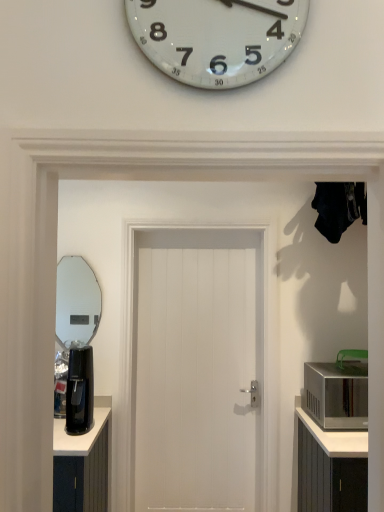
Question: Considering the relative positions of black plastic coffee machine at left and silver metallic microwave at right in the image provided, is black plastic coffee machine at left behind silver metallic microwave at right?

Choices:
 (A) yes
 (B) no

Answer: (B)

Question: Considering the relative sizes of black plastic coffee machine at left and silver metallic microwave at right in the image provided, is black plastic coffee machine at left smaller than silver metallic microwave at right?

Choices:
 (A) yes
 (B) no

Answer: (A)

Question: Is silver metallic microwave at right at the back of black plastic coffee machine at left?

Choices:
 (A) no
 (B) yes

Answer: (A)

Question: Is black plastic coffee machine at left bigger than silver metallic microwave at right?

Choices:
 (A) no
 (B) yes

Answer: (A)

Question: From a real-world perspective, is black plastic coffee machine at left over silver metallic microwave at right?

Choices:
 (A) no
 (B) yes

Answer: (B)

Question: Is point (81, 301) closer or farther from the camera than point (173, 371)?

Choices:
 (A) closer
 (B) farther

Answer: (B)

Question: From the image's perspective, is clear glass mirror at left located above or below white wooden door at center?

Choices:
 (A) above
 (B) below

Answer: (A)

Question: Considering their positions, is clear glass mirror at left located in front of or behind white wooden door at center?

Choices:
 (A) front
 (B) behind

Answer: (B)

Question: Visually, is clear glass mirror at left positioned to the left or to the right of white wooden door at center?

Choices:
 (A) left
 (B) right

Answer: (A)

Question: In terms of width, does black plastic coffee machine at left look wider or thinner when compared to white wooden door at center?

Choices:
 (A) thin
 (B) wide

Answer: (B)

Question: In the image, is black plastic coffee machine at left on the left side or the right side of white wooden door at center?

Choices:
 (A) left
 (B) right

Answer: (A)

Question: Considering the positions of black plastic coffee machine at left and white wooden door at center in the image, is black plastic coffee machine at left bigger or smaller than white wooden door at center?

Choices:
 (A) big
 (B) small

Answer: (B)

Question: Is point (66, 416) positioned closer to the camera than point (206, 345)?

Choices:
 (A) farther
 (B) closer

Answer: (B)

Question: Looking at their shapes, would you say clear glass mirror at left is wider or thinner than silver metallic microwave at right?

Choices:
 (A) thin
 (B) wide

Answer: (A)

Question: From their relative heights in the image, would you say clear glass mirror at left is taller or shorter than silver metallic microwave at right?

Choices:
 (A) tall
 (B) short

Answer: (A)